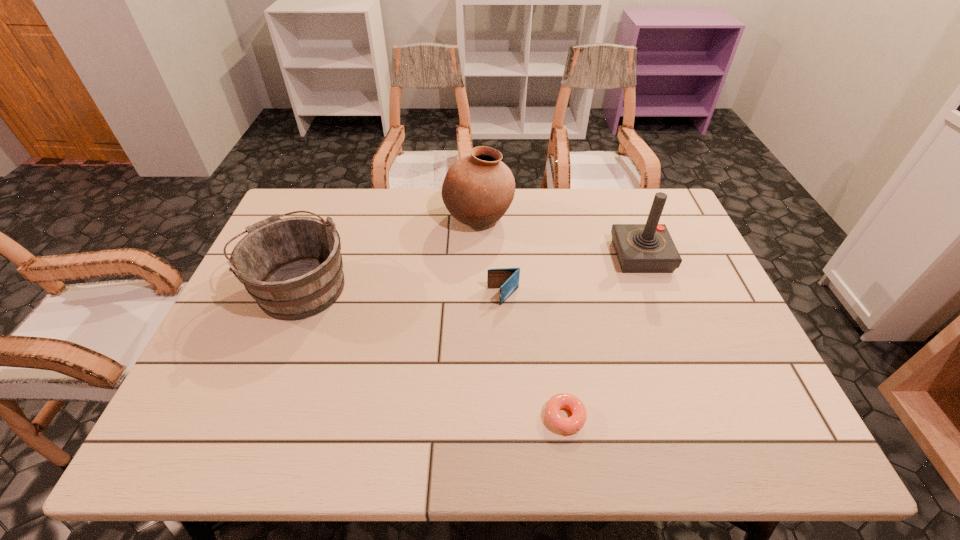
Identify the location of vacant region located on the rectangular base of the rightmost object. [556, 256].

Locate an element on the screen. The width and height of the screenshot is (960, 540). free region located 0.180m on the front of the third shortest object is located at coordinates (256, 390).

At what (x,y) coordinates should I click in order to perform the action: click on vacant area situated 0.200m on the exterior surface of the wallet. Please return your answer as a coordinate pair (x, y). The image size is (960, 540). Looking at the image, I should click on (413, 296).

Where is `free location located 0.390m on the exterior surface of the wallet`? The width and height of the screenshot is (960, 540). free location located 0.390m on the exterior surface of the wallet is located at coordinates (342, 296).

Locate an element on the screen. This screenshot has width=960, height=540. free point located 0.310m on the exterior surface of the wallet is located at coordinates (372, 296).

You are a GUI agent. You are given a task and a screenshot of the screen. Output one action in this format:
    pyautogui.click(x=<x>, y=<y>)
    Task: Click on the blank space located 0.320m on the left of the doughnut
    This screenshot has width=960, height=540.
    Given the screenshot: What is the action you would take?
    pyautogui.click(x=394, y=417)

You are a GUI agent. You are given a task and a screenshot of the screen. Output one action in this format:
    pyautogui.click(x=<x>, y=<y>)
    Task: Click on the object that is at the far edge
    The height and width of the screenshot is (540, 960).
    Given the screenshot: What is the action you would take?
    pyautogui.click(x=478, y=189)

The image size is (960, 540). I want to click on object located in the near edge section of the desktop, so click(567, 425).

Find the location of a particular element. This screenshot has height=540, width=960. object located at the left edge is located at coordinates (293, 268).

At what (x,y) coordinates should I click in order to perform the action: click on object that is at the right edge. Please return your answer as a coordinate pair (x, y). This screenshot has height=540, width=960. Looking at the image, I should click on (640, 248).